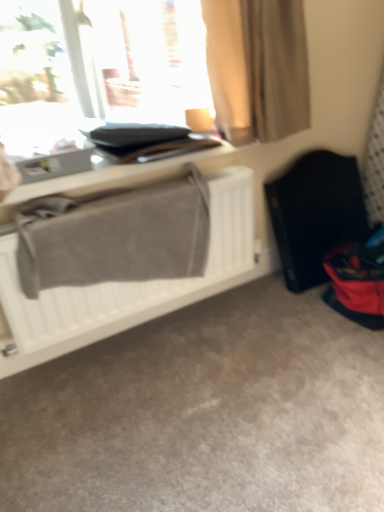
What is the approximate width of beige fabric curtain at upper center?

8.19 inches.

This screenshot has height=512, width=384. Describe the element at coordinates (131, 282) in the screenshot. I see `gray fabric at left` at that location.

Where is `transparent glass window at upper left`? This screenshot has width=384, height=512. transparent glass window at upper left is located at coordinates (139, 59).

Where is `black fabric folding chair at right`? black fabric folding chair at right is located at coordinates (315, 214).

Identify the location of beige fabric curtain at upper center. (257, 67).

Would you say black fabric folding chair at right is a long distance from beige fabric curtain at upper center?

They are positioned close to each other.

In terms of width, does black fabric folding chair at right look wider or thinner when compared to beige fabric curtain at upper center?

black fabric folding chair at right is wider than beige fabric curtain at upper center.

How many degrees apart are the facing directions of black fabric folding chair at right and beige fabric curtain at upper center?

The angle between the facing direction of black fabric folding chair at right and the facing direction of beige fabric curtain at upper center is 1.79 degrees.

Looking at this image, from the image's perspective, between black fabric folding chair at right and beige fabric curtain at upper center, which one is located above?

beige fabric curtain at upper center is shown above in the image.

Is transparent glass window at upper left at the left side of black fabric folding chair at right?

Correct, you'll find transparent glass window at upper left to the left of black fabric folding chair at right.

From the picture: Is black fabric folding chair at right at the back of transparent glass window at upper left?

No, transparent glass window at upper left is not facing the opposite direction of black fabric folding chair at right.

Is transparent glass window at upper left not close to black fabric folding chair at right?

No, transparent glass window at upper left is not far away from black fabric folding chair at right.

Considering the relative sizes of gray fabric at left and beige fabric curtain at upper center in the image provided, is gray fabric at left smaller than beige fabric curtain at upper center?

No.

Is gray fabric at left facing towards beige fabric curtain at upper center?

No.

Is gray fabric at left thinner than beige fabric curtain at upper center?

Yes, gray fabric at left is thinner than beige fabric curtain at upper center.

Is gray fabric at left located outside black fabric folding chair at right?

Yes, gray fabric at left is not within black fabric folding chair at right.

In the scene shown: Which is in front, gray fabric at left or black fabric folding chair at right?

gray fabric at left is closer to the camera.

How many degrees apart are the facing directions of gray fabric at left and black fabric folding chair at right?

The angle between the facing direction of gray fabric at left and the facing direction of black fabric folding chair at right is 0.423 degrees.

Is there a large distance between gray fabric at left and black fabric folding chair at right?

No, there isn't a large distance between gray fabric at left and black fabric folding chair at right.

From a real-world perspective, is matte gray table at upper left over transparent glass window at upper left?

Actually, matte gray table at upper left is physically below transparent glass window at upper left in the real world.

Does point (186, 158) come behind point (124, 118)?

That is True.

Considering the positions of objects matte gray table at upper left and transparent glass window at upper left in the image provided, who is more to the right, matte gray table at upper left or transparent glass window at upper left?

Positioned to the right is matte gray table at upper left.

Can you confirm if matte gray table at upper left is smaller than transparent glass window at upper left?

Indeed, matte gray table at upper left has a smaller size compared to transparent glass window at upper left.

Locate an element on the screen. window on the left of matte gray table at upper left is located at coordinates (139, 59).

Considering the relative sizes of transparent glass window at upper left and matte gray table at upper left in the image provided, is transparent glass window at upper left taller than matte gray table at upper left?

Yes, transparent glass window at upper left is taller than matte gray table at upper left.

Is transparent glass window at upper left touching matte gray table at upper left?

transparent glass window at upper left and matte gray table at upper left are not in contact.

Does transparent glass window at upper left have a smaller size compared to matte gray table at upper left?

No, transparent glass window at upper left is not smaller than matte gray table at upper left.

Relative to beige fabric curtain at upper center, is matte gray table at upper left in front or behind?

In the image, matte gray table at upper left appears behind beige fabric curtain at upper center.

Can you confirm if matte gray table at upper left is thinner than beige fabric curtain at upper center?

Incorrect, the width of matte gray table at upper left is not less than that of beige fabric curtain at upper center.

Who is bigger, matte gray table at upper left or beige fabric curtain at upper center?

beige fabric curtain at upper center is bigger.

The width and height of the screenshot is (384, 512). Identify the location of folding chair behind the beige fabric curtain at upper center. (315, 214).

This screenshot has width=384, height=512. In the image, there is a transparent glass window at upper left. In order to click on folding chair below it (from the image's perspective) in this screenshot , I will do `click(315, 214)`.

Which object lies nearer to the anchor point matte gray table at upper left, beige fabric curtain at upper center or gray fabric at left?

gray fabric at left is closer to matte gray table at upper left.

Based on their spatial positions, is gray fabric at left or beige fabric curtain at upper center further from matte gray table at upper left?

Based on the image, beige fabric curtain at upper center appears to be further to matte gray table at upper left.

Considering their positions, is transparent glass window at upper left positioned further to beige fabric curtain at upper center than black fabric folding chair at right?

Based on the image, black fabric folding chair at right appears to be further to beige fabric curtain at upper center.

From the picture: When comparing their distances from gray fabric at left, does black fabric folding chair at right or transparent glass window at upper left seem further?

Based on the image, transparent glass window at upper left appears to be further to gray fabric at left.

Estimate the real-world distances between objects in this image. Which object is closer to matte gray table at upper left, black fabric folding chair at right or gray fabric at left?

gray fabric at left is closer to matte gray table at upper left.

Which object lies nearer to the anchor point black fabric folding chair at right, matte gray table at upper left or beige fabric curtain at upper center?

beige fabric curtain at upper center lies closer to black fabric folding chair at right than the other object.

From the image, which object appears to be farther from matte gray table at upper left, transparent glass window at upper left or black fabric folding chair at right?

black fabric folding chair at right is further to matte gray table at upper left.

Estimate the real-world distances between objects in this image. Which object is further from transparent glass window at upper left, beige fabric curtain at upper center or gray fabric at left?

gray fabric at left is further to transparent glass window at upper left.

Locate an element on the screen. This screenshot has height=512, width=384. curtain between gray fabric at left and black fabric folding chair at right in the horizontal direction is located at coordinates (257, 67).

This screenshot has height=512, width=384. Find the location of `table between transparent glass window at upper left and beige fabric curtain at upper center from left to right`. table between transparent glass window at upper left and beige fabric curtain at upper center from left to right is located at coordinates (113, 178).

Image resolution: width=384 pixels, height=512 pixels. I want to click on radiator between transparent glass window at upper left and black fabric folding chair at right, so click(x=131, y=282).

At what (x,y) coordinates should I click in order to perform the action: click on table between transparent glass window at upper left and gray fabric at left from top to bottom. Please return your answer as a coordinate pair (x, y). The height and width of the screenshot is (512, 384). Looking at the image, I should click on (113, 178).